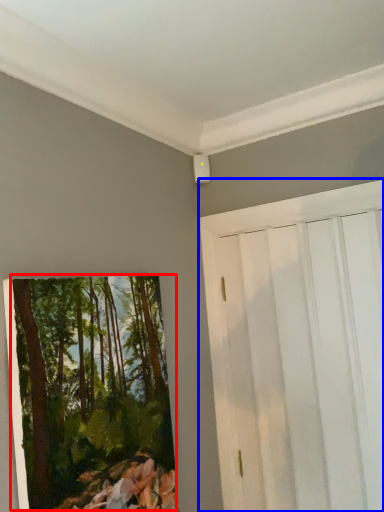
Question: Among these objects, which one is farthest to the camera, tree (highlighted by a red box) or barn door (highlighted by a blue box)?

Choices:
 (A) tree
 (B) barn door

Answer: (B)